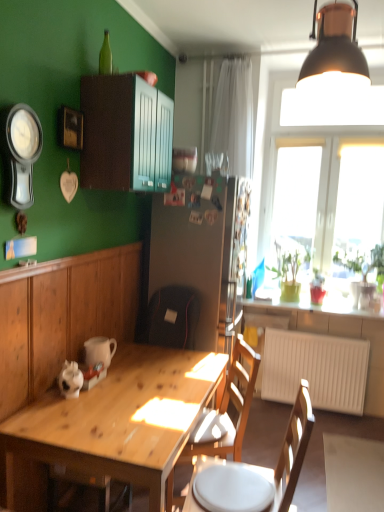
Question: Does wooden picture frame at upper left have a lesser height compared to matte wood cabinet at upper center, which appears as the 2th cabinetry when ordered from the bottom?

Choices:
 (A) no
 (B) yes

Answer: (B)

Question: Can you confirm if wooden picture frame at upper left is smaller than matte wood cabinet at upper center, which is counted as the 1th cabinetry, starting from the top?

Choices:
 (A) no
 (B) yes

Answer: (B)

Question: Is wooden picture frame at upper left oriented away from matte wood cabinet at upper center, which appears as the 2th cabinetry when ordered from the bottom?

Choices:
 (A) no
 (B) yes

Answer: (A)

Question: Is wooden picture frame at upper left outside matte wood cabinet at upper center, which is counted as the 1th cabinetry, starting from the top?

Choices:
 (A) no
 (B) yes

Answer: (B)

Question: Does wooden picture frame at upper left lie behind matte wood cabinet at upper center, which is counted as the 1th cabinetry, starting from the top?

Choices:
 (A) no
 (B) yes

Answer: (A)

Question: Considering the relative positions of green glossy plant at window, the second houseplant when ordered from left to right, and smooth white countertop at window in the image provided, is green glossy plant at window, the second houseplant when ordered from left to right, to the left or to the right of smooth white countertop at window?

Choices:
 (A) right
 (B) left

Answer: (A)

Question: Which is correct: green glossy plant at window, the 2th houseplant positioned from the back, is inside smooth white countertop at window, or outside of it?

Choices:
 (A) outside
 (B) inside

Answer: (A)

Question: Does point (362, 271) appear closer or farther from the camera than point (334, 300)?

Choices:
 (A) closer
 (B) farther

Answer: (A)

Question: Is green glossy plant at window, the 2th houseplant positioned from the back, wider or thinner than smooth white countertop at window?

Choices:
 (A) thin
 (B) wide

Answer: (A)

Question: From a real-world perspective, relative to wooden table at lower left, which appears as the first cabinetry when ordered from the bottom, is matte white mug at lower left vertically above or below?

Choices:
 (A) below
 (B) above

Answer: (B)

Question: Looking at their shapes, would you say matte white mug at lower left is wider or thinner than wooden table at lower left, which appears as the first cabinetry when ordered from the bottom?

Choices:
 (A) wide
 (B) thin

Answer: (A)

Question: From the image's perspective, is matte white mug at lower left above or below wooden table at lower left, which appears as the first cabinetry when ordered from the bottom?

Choices:
 (A) above
 (B) below

Answer: (A)

Question: Is point (87, 342) positioned closer to the camera than point (26, 379)?

Choices:
 (A) closer
 (B) farther

Answer: (B)

Question: Considering the positions of metallic silver clock at upper left and green matte plant at window, the 1th houseplant in the back-to-front sequence, in the image, is metallic silver clock at upper left wider or thinner than green matte plant at window, the 1th houseplant in the back-to-front sequence,?

Choices:
 (A) thin
 (B) wide

Answer: (A)

Question: Considering their positions, is metallic silver clock at upper left located in front of or behind green matte plant at window, which ranks as the second houseplant in right-to-left order?

Choices:
 (A) front
 (B) behind

Answer: (A)